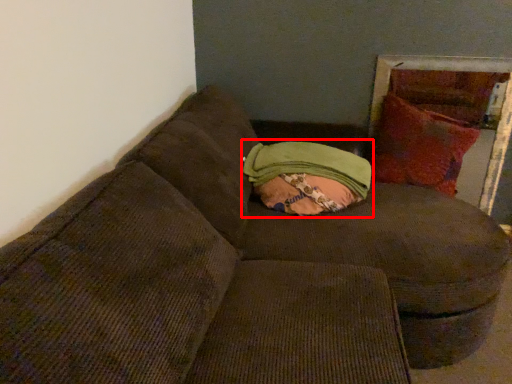
Question: Observing the image, what is the correct spatial positioning of bean bag chair (annotated by the red box) in reference to throw pillow?

Choices:
 (A) left
 (B) right

Answer: (A)